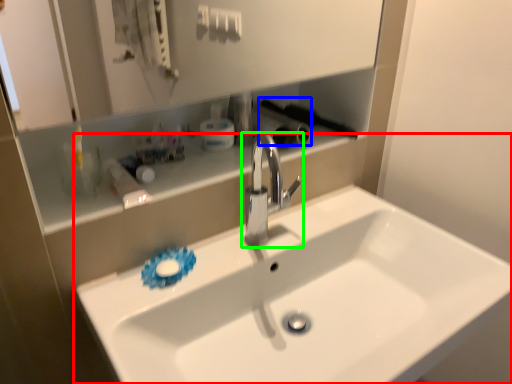
Question: Which is nearer to the sink (highlighted by a red box)? brush (highlighted by a blue box) or tap (highlighted by a green box).

Choices:
 (A) brush
 (B) tap

Answer: (B)